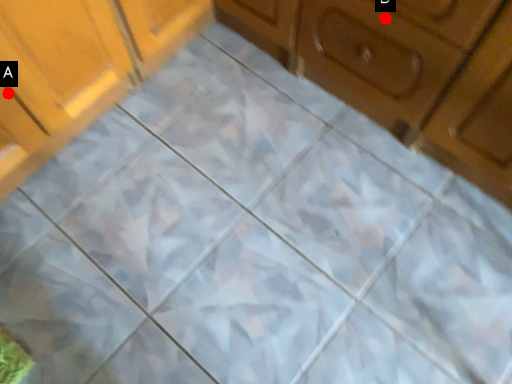
Question: Two points are circled on the image, labeled by A and B beside each circle. Which point is further to the camera?

Choices:
 (A) A is further
 (B) B is further

Answer: (A)